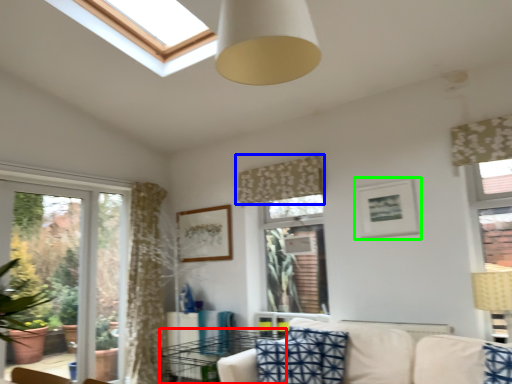
Question: Based on their relative distances, which object is farther from table (highlighted by a red box)? Choose from curtain (highlighted by a blue box) and picture frame (highlighted by a green box).

Choices:
 (A) curtain
 (B) picture frame

Answer: (B)